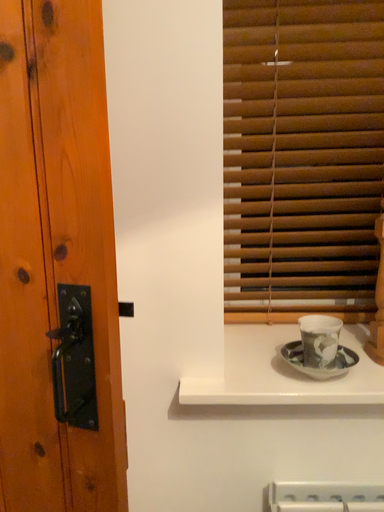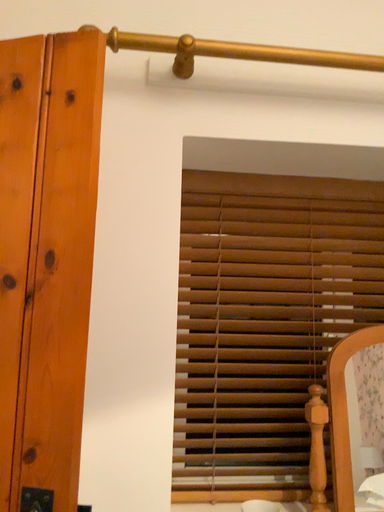
Question: How did the camera likely rotate when shooting the video?

Choices:
 (A) rotated downward
 (B) rotated upward

Answer: (B)